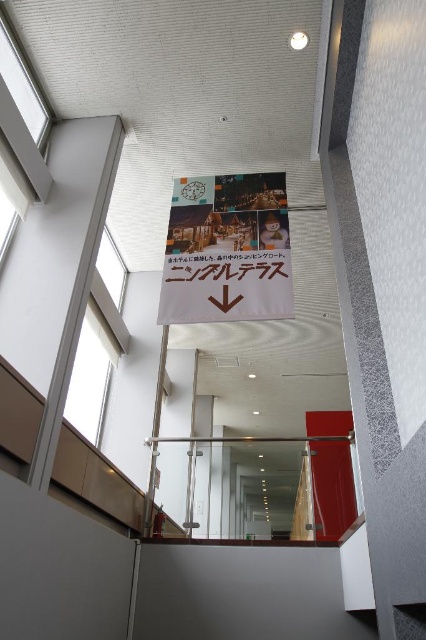
Is clear glass window at upper left in front of transparent glass window at upper center?

Yes, it is.

Which is behind, point (13, 83) or point (123, 285)?

Positioned behind is point (123, 285).

I want to click on clear glass window at upper left, so click(23, 86).

This screenshot has height=640, width=426. What are the coordinates of `transparent glass window at upper left` in the screenshot? It's located at (92, 374).

This screenshot has width=426, height=640. Describe the element at coordinates (92, 374) in the screenshot. I see `transparent glass window at upper left` at that location.

This screenshot has width=426, height=640. In order to click on transparent glass window at upper left in this screenshot , I will do `click(92, 374)`.

Does matte paper poster at center have a greater height compared to transparent glass window at upper left?

Incorrect, matte paper poster at center's height is not larger of transparent glass window at upper left's.

Between matte paper poster at center and transparent glass window at upper left, which one is positioned lower?

transparent glass window at upper left is below.

You are a GUI agent. You are given a task and a screenshot of the screen. Output one action in this format:
    pyautogui.click(x=<x>, y=<y>)
    Task: Click on the matte paper poster at center
    The image size is (426, 640).
    Given the screenshot: What is the action you would take?
    pyautogui.click(x=227, y=250)